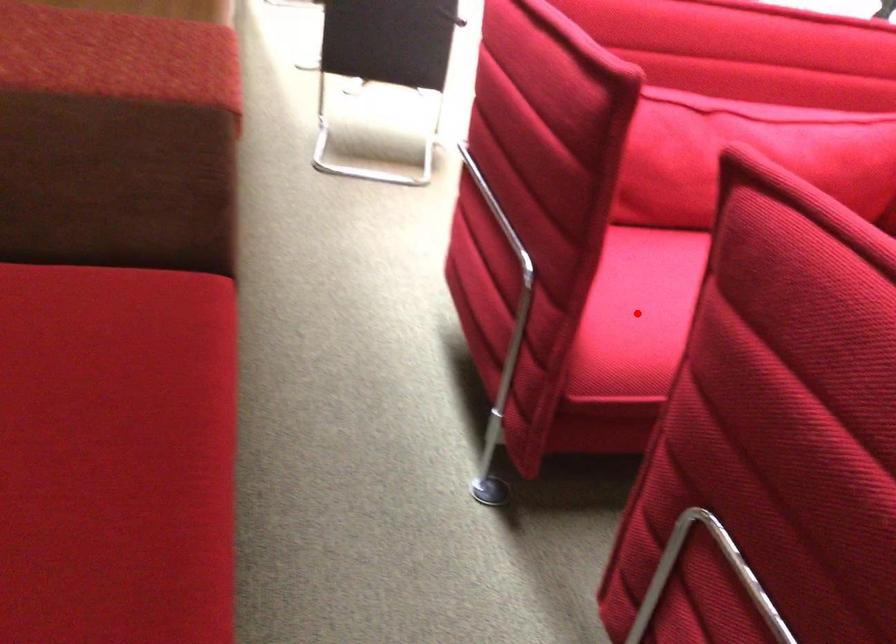
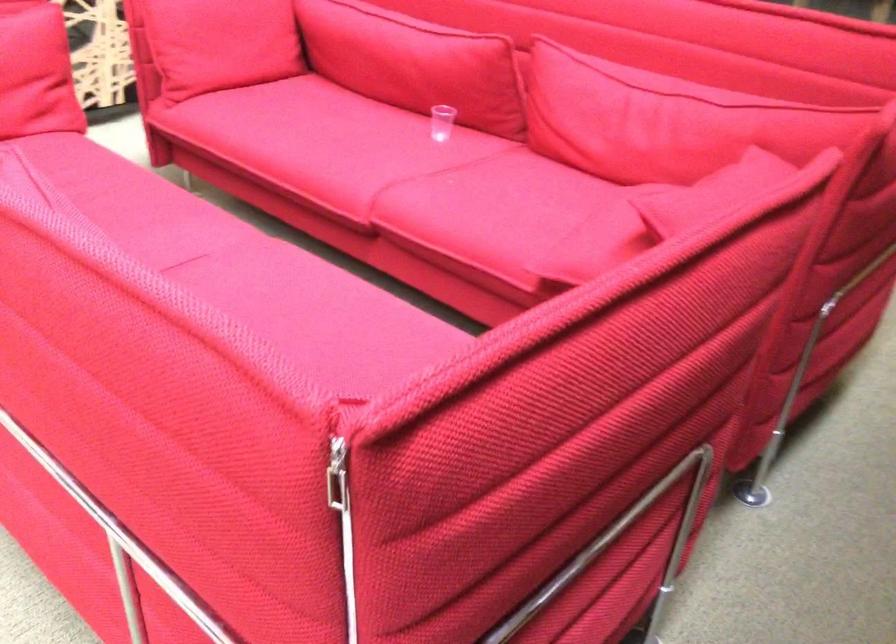
Question: I am providing you with two images of the same scene from different viewpoints. A red point is marked on the first image. Can you still see the location of the red point in image 2?

Choices:
 (A) Yes
 (B) No

Answer: (B)